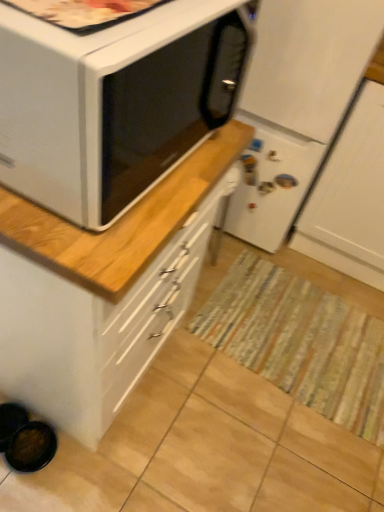
Question: Does white matte refrigerator at center have a lesser height compared to striped fabric mat at center?

Choices:
 (A) no
 (B) yes

Answer: (A)

Question: Is white matte refrigerator at center facing away from striped fabric mat at center?

Choices:
 (A) yes
 (B) no

Answer: (B)

Question: Is white matte refrigerator at center smaller than striped fabric mat at center?

Choices:
 (A) no
 (B) yes

Answer: (A)

Question: From the image's perspective, would you say white matte refrigerator at center is shown under striped fabric mat at center?

Choices:
 (A) no
 (B) yes

Answer: (A)

Question: Does white matte refrigerator at center have a greater width compared to striped fabric mat at center?

Choices:
 (A) yes
 (B) no

Answer: (A)

Question: Looking at the image, does striped fabric mat at center seem bigger or smaller compared to white glossy cabinet at upper left?

Choices:
 (A) small
 (B) big

Answer: (A)

Question: From the image's perspective, is striped fabric mat at center positioned above or below white glossy cabinet at upper left?

Choices:
 (A) below
 (B) above

Answer: (A)

Question: Considering the positions of striped fabric mat at center and white glossy cabinet at upper left in the image, is striped fabric mat at center taller or shorter than white glossy cabinet at upper left?

Choices:
 (A) tall
 (B) short

Answer: (B)

Question: From a real-world perspective, relative to white glossy cabinet at upper left, is striped fabric mat at center vertically above or below?

Choices:
 (A) below
 (B) above

Answer: (A)

Question: Is white matte refrigerator at center in front of or behind striped fabric mat at center in the image?

Choices:
 (A) front
 (B) behind

Answer: (A)

Question: Does point (271, 138) appear closer or farther from the camera than point (248, 279)?

Choices:
 (A) farther
 (B) closer

Answer: (B)

Question: Do you think white matte refrigerator at center is within striped fabric mat at center, or outside of it?

Choices:
 (A) outside
 (B) inside

Answer: (A)

Question: Visually, is white matte refrigerator at center positioned to the left or to the right of striped fabric mat at center?

Choices:
 (A) left
 (B) right

Answer: (A)

Question: Considering their positions, is white matte microwave oven at upper left located in front of or behind white glossy cabinet at upper left?

Choices:
 (A) behind
 (B) front

Answer: (B)

Question: Is white matte microwave oven at upper left taller or shorter than white glossy cabinet at upper left?

Choices:
 (A) short
 (B) tall

Answer: (A)